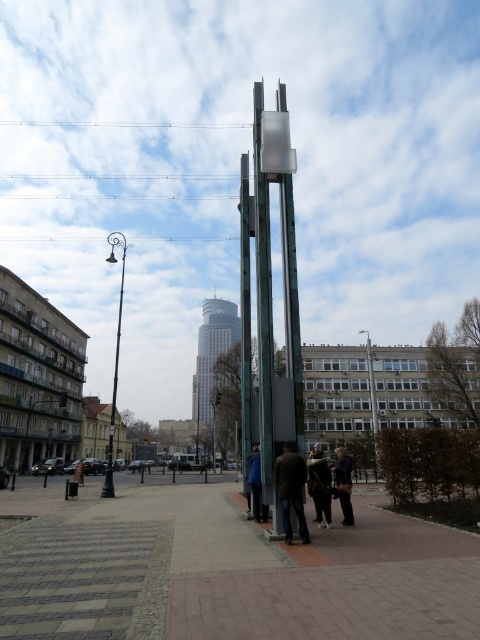
Which is above, brick pavement at center or dark brown fur coat at lower center?

Positioned higher is dark brown fur coat at lower center.

Does brick pavement at center appear on the left side of dark brown fur coat at lower center?

Yes, brick pavement at center is to the left of dark brown fur coat at lower center.

Which is behind, point (219, 545) or point (326, 504)?

The point (326, 504) is behind.

Locate an element on the screen. brick pavement at center is located at coordinates (223, 568).

Based on the photo, between glassy silver skyscraper at center and dark brown fur coat at lower center, which one is positioned higher?

dark brown fur coat at lower center is above.

The height and width of the screenshot is (640, 480). Describe the element at coordinates (211, 360) in the screenshot. I see `glassy silver skyscraper at center` at that location.

The width and height of the screenshot is (480, 640). What are the coordinates of `glassy silver skyscraper at center` in the screenshot? It's located at (211, 360).

Who is positioned more to the left, brick pavement at center or dark purple jacket at lower right?

Positioned to the left is brick pavement at center.

Does brick pavement at center have a smaller size compared to dark purple jacket at lower right?

No.

What do you see at coordinates (223, 568) in the screenshot? This screenshot has height=640, width=480. I see `brick pavement at center` at bounding box center [223, 568].

Where is `brick pavement at center`? Image resolution: width=480 pixels, height=640 pixels. brick pavement at center is located at coordinates (223, 568).